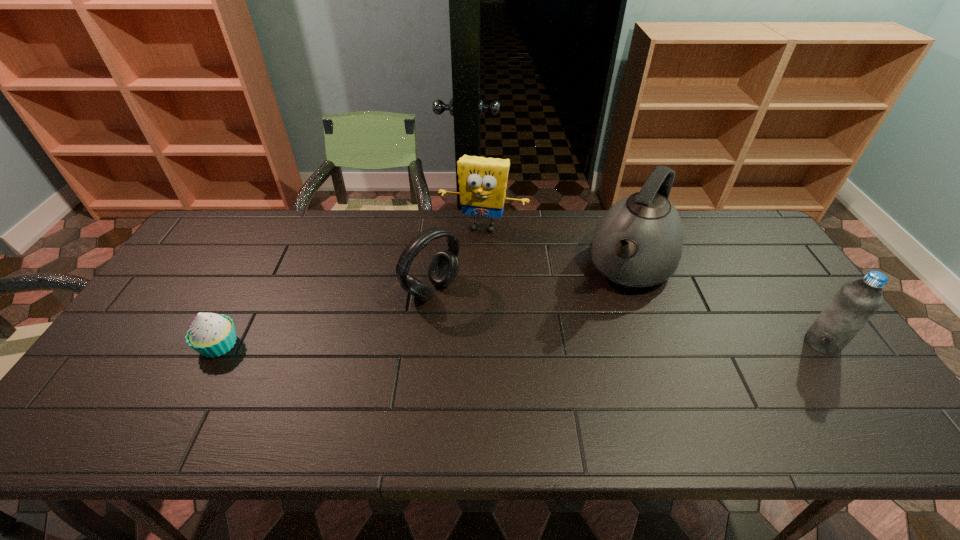
At what (x,y) coordinates should I click in order to perform the action: click on free spot between the second object from right to left and the water bottle. Please return your answer as a coordinate pair (x, y). The image size is (960, 540). Looking at the image, I should click on (728, 305).

The width and height of the screenshot is (960, 540). What are the coordinates of `vacant space that's between the leftmost object and the tallest object` in the screenshot? It's located at (425, 306).

The width and height of the screenshot is (960, 540). I want to click on free area in between the headset and the rightmost object, so click(x=627, y=316).

This screenshot has height=540, width=960. I want to click on vacant area that lies between the tallest object and the shortest object, so click(425, 306).

At what (x,y) coordinates should I click in order to perform the action: click on vacant space in between the water bottle and the headset. Please return your answer as a coordinate pair (x, y). This screenshot has width=960, height=540. Looking at the image, I should click on (627, 316).

Find the location of `free space between the tallest object and the rightmost object`. free space between the tallest object and the rightmost object is located at coordinates (728, 305).

This screenshot has width=960, height=540. What are the coordinates of `object that is the closest to the leftmost object` in the screenshot? It's located at (443, 269).

Select which object is the fourth closest to the rightmost object. Please provide its 2D coordinates. Your answer should be formatted as a tuple, i.e. [(x, y)], where the tuple contains the x and y coordinates of a point satisfying the conditions above.

[(212, 335)]

Where is `vacant space that satisfies the following two spatial constraints: 1. on the back side of the rightmost object; 2. on the right side of the shortest object`? The height and width of the screenshot is (540, 960). vacant space that satisfies the following two spatial constraints: 1. on the back side of the rightmost object; 2. on the right side of the shortest object is located at coordinates (220, 342).

You are a GUI agent. You are given a task and a screenshot of the screen. Output one action in this format:
    pyautogui.click(x=<x>, y=<y>)
    Task: Click on the blank area in the image that satisfies the following two spatial constraints: 1. on the front side of the sponge; 2. on the right side of the kettle
    This screenshot has height=540, width=960.
    Given the screenshot: What is the action you would take?
    pyautogui.click(x=484, y=267)